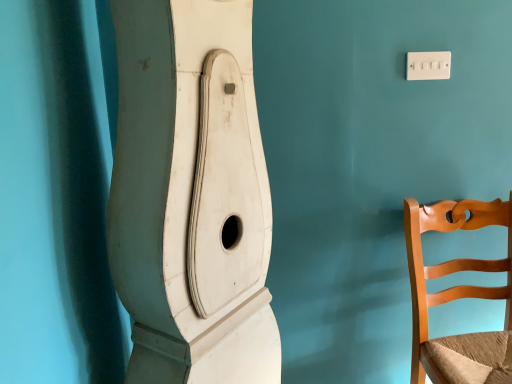
Question: In terms of height, does white plastic light switch at upper right look taller or shorter compared to light brown wooden chair at right?

Choices:
 (A) short
 (B) tall

Answer: (A)

Question: Does point (421, 56) appear closer or farther from the camera than point (457, 367)?

Choices:
 (A) farther
 (B) closer

Answer: (A)

Question: Choose the correct answer: Is white plastic light switch at upper right inside light brown wooden chair at right or outside it?

Choices:
 (A) inside
 (B) outside

Answer: (B)

Question: Is light brown wooden chair at right bigger or smaller than white plastic light switch at upper right?

Choices:
 (A) small
 (B) big

Answer: (B)

Question: Choose the correct answer: Is light brown wooden chair at right inside white plastic light switch at upper right or outside it?

Choices:
 (A) inside
 (B) outside

Answer: (B)

Question: Is light brown wooden chair at right in front of or behind white plastic light switch at upper right in the image?

Choices:
 (A) front
 (B) behind

Answer: (A)

Question: Is point (478, 288) closer or farther from the camera than point (437, 52)?

Choices:
 (A) closer
 (B) farther

Answer: (B)